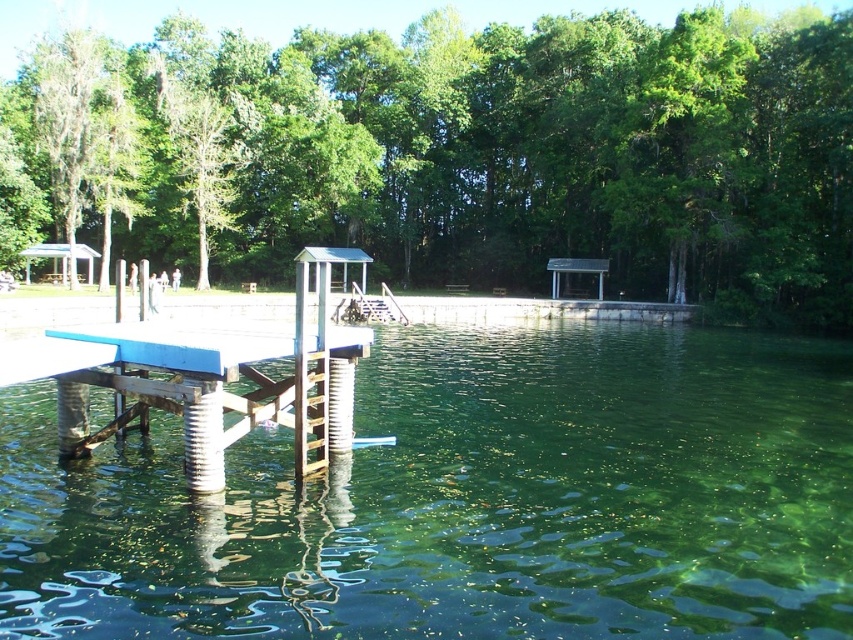
Question: Does green leafy tree at center have a lesser width compared to blue painted wood picnic table at center?

Choices:
 (A) no
 (B) yes

Answer: (A)

Question: Considering the relative positions of green translucent water at center and green leafy tree at center in the image provided, where is green translucent water at center located with respect to green leafy tree at center?

Choices:
 (A) above
 (B) below

Answer: (B)

Question: Does green translucent water at center appear on the right side of green leafy tree at center?

Choices:
 (A) yes
 (B) no

Answer: (A)

Question: Which object is closer to the camera taking this photo?

Choices:
 (A) green leafy tree at center
 (B) blue painted wood picnic table at center
 (C) green translucent water at center

Answer: (C)

Question: Which object appears farthest from the camera in this image?

Choices:
 (A) green translucent water at center
 (B) blue painted wood picnic table at center
 (C) green leafy tree at center

Answer: (C)

Question: Based on their relative distances, which object is nearer to the green leafy tree at center?

Choices:
 (A) green translucent water at center
 (B) blue painted wood picnic table at center

Answer: (B)